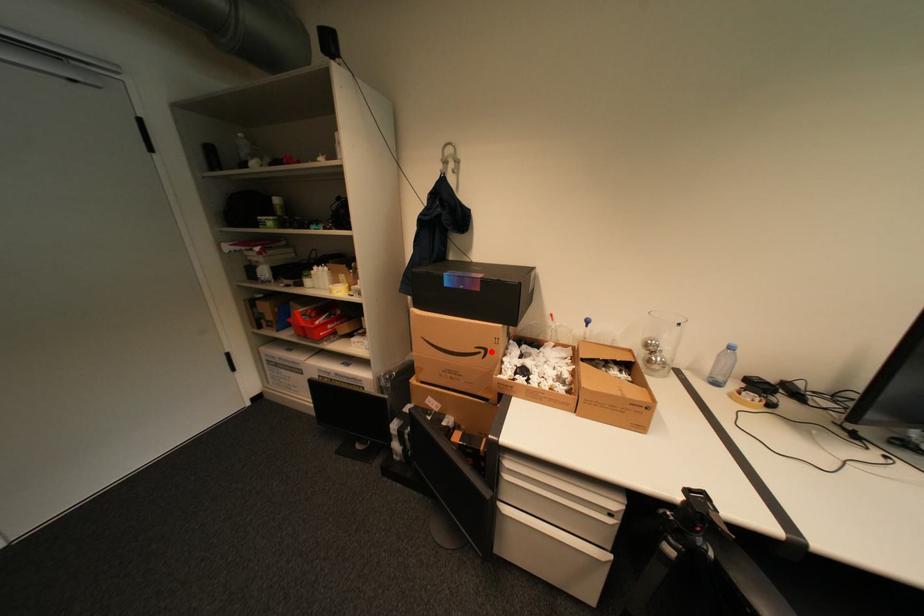
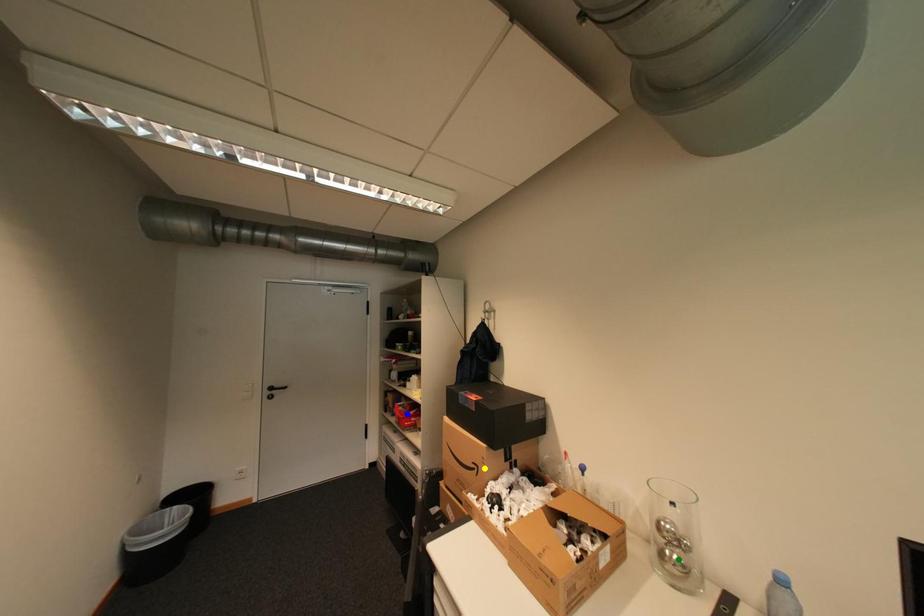
Question: I am providing you with two images of the same scene from different viewpoints. A red point is marked on the first image. You are given multiple points on the second image. Which point in image 2 is actually the same real-world point as the red point in image 1?

Choices:
 (A) yellow point
 (B) blue point
 (C) green point

Answer: (A)